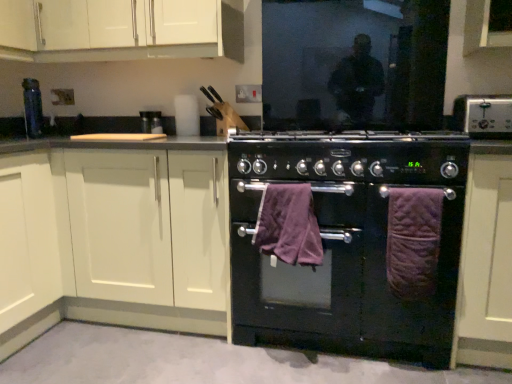
Question: Is point (6, 9) positioned closer to the camera than point (141, 122)?

Choices:
 (A) closer
 (B) farther

Answer: (A)

Question: Visually, is white matte cabinet at upper left, arranged as the 2th cabinetry when viewed from the right, positioned to the left or to the right of matte black knife block at upper center, acting as the second appliance starting from the front?

Choices:
 (A) right
 (B) left

Answer: (A)

Question: Estimate the real-world distances between objects in this image. Which object is closer to the black matte oven at center, which ranks as the second appliance in top-to-bottom order?

Choices:
 (A) matte white cabinet at right, which is the third cabinetry in left-to-right order
 (B) silver metallic toaster at upper right
 (C) purple plush bath towel at center, which appears as the 1th bath towel when viewed from the left
 (D) matte black knife block at upper center, placed as the second appliance when sorted from bottom to top
 (E) black matte oven at center

Answer: (E)

Question: Estimate the real-world distances between objects in this image. Which object is closer to the silver metallic toaster at upper right?

Choices:
 (A) white matte cabinet at upper left, arranged as the 2th cabinetry when viewed from the right
 (B) purple quilted bath towel at right, which is the first bath towel in right-to-left order
 (C) matte black knife block at upper center, the 1th appliance when ordered from back to front
 (D) matte white cabinet at right, which is the third cabinetry in left-to-right order
 (E) black matte oven at center

Answer: (D)